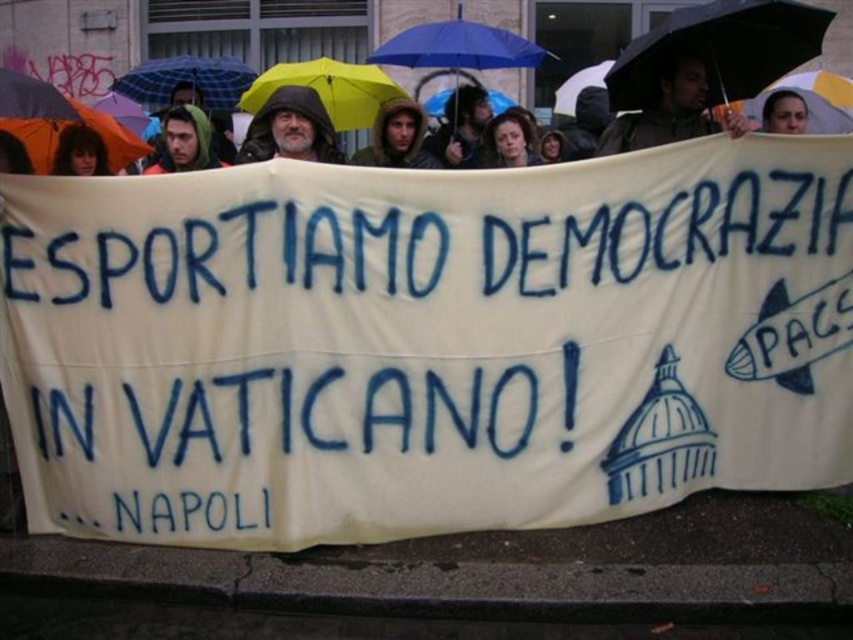
Between green hooded jacket at center and green hooded jacket at upper left, which one appears on the right side from the viewer's perspective?

green hooded jacket at center

Can you confirm if green hooded jacket at center is taller than green hooded jacket at upper left?

No, green hooded jacket at center is not taller than green hooded jacket at upper left.

Does point (393, 128) come farther from viewer compared to point (190, 108)?

Yes, point (393, 128) is farther from viewer.

At what (x,y) coordinates should I click in order to perform the action: click on green hooded jacket at center. Please return your answer as a coordinate pair (x, y). This screenshot has width=853, height=640. Looking at the image, I should click on (396, 138).

Locate an element on the screen. This screenshot has height=640, width=853. black matte umbrella at upper center is located at coordinates (718, 49).

Is black matte umbrella at upper center to the left of dark brown hair at center from the viewer's perspective?

Incorrect, black matte umbrella at upper center is not on the left side of dark brown hair at center.

Which is in front, point (804, 44) or point (442, 163)?

Point (804, 44)

At what (x,y) coordinates should I click in order to perform the action: click on black matte umbrella at upper center. Please return your answer as a coordinate pair (x, y). The height and width of the screenshot is (640, 853). Looking at the image, I should click on (718, 49).

Between dark brown hair at center and smooth skin face at upper right, which one appears on the right side from the viewer's perspective?

Positioned to the right is smooth skin face at upper right.

Does dark brown hair at center have a smaller size compared to smooth skin face at upper right?

No.

Is point (434, 157) closer to camera compared to point (792, 100)?

No, it is behind (792, 100).

Identify the location of dark brown hair at center. Image resolution: width=853 pixels, height=640 pixels. (459, 129).